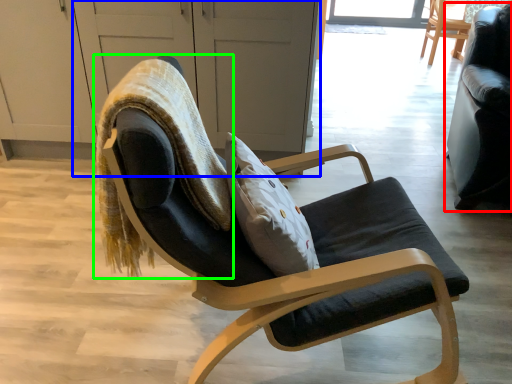
Question: Which object is positioned closest to chair (highlighted by a red box)? Select from screen door (highlighted by a blue box) and bean bag chair (highlighted by a green box).

Choices:
 (A) screen door
 (B) bean bag chair

Answer: (A)